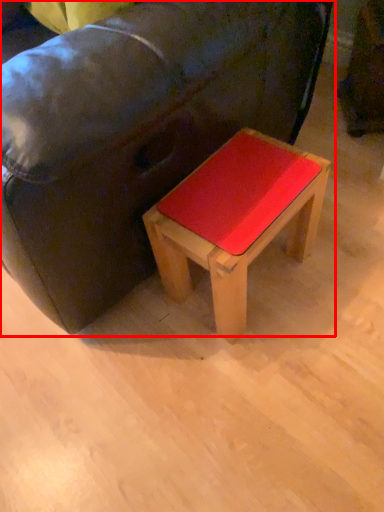
Question: From the image's perspective, what is the correct spatial relationship of studio couch (annotated by the red box) in relation to stool?

Choices:
 (A) below
 (B) above

Answer: (B)